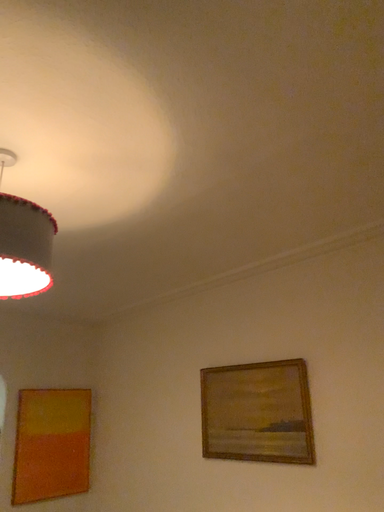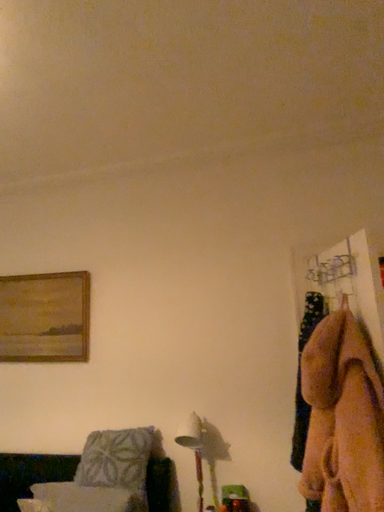
Question: Which way did the camera rotate in the video?

Choices:
 (A) rotated left
 (B) rotated right

Answer: (B)